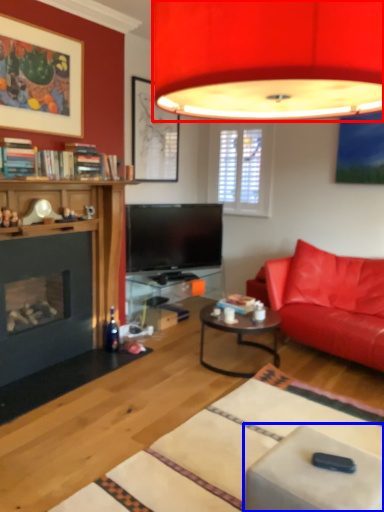
Question: Which object is further to the camera taking this photo, lamp (highlighted by a red box) or swivel chair (highlighted by a blue box)?

Choices:
 (A) lamp
 (B) swivel chair

Answer: (B)